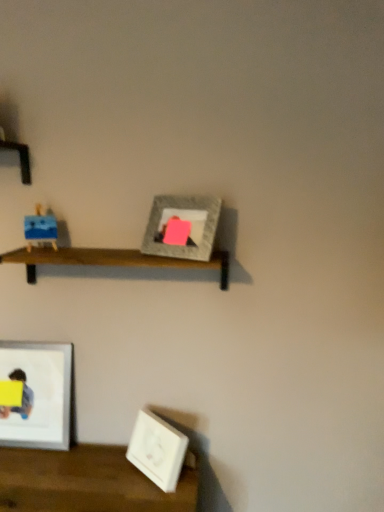
The height and width of the screenshot is (512, 384). What do you see at coordinates (22, 397) in the screenshot? I see `yellow matte paper at lower left` at bounding box center [22, 397].

This screenshot has width=384, height=512. I want to click on yellow matte paper at lower left, so click(x=22, y=397).

Could you tell me if white glossy picture frame at lower left, which is the second picture frame from top to bottom, is facing matte blue toy at left?

No.

How far apart are white glossy picture frame at lower left, the first picture frame when ordered from left to right, and matte blue toy at left?

white glossy picture frame at lower left, the first picture frame when ordered from left to right, is 19.35 inches away from matte blue toy at left.

Considering the positions of point (39, 394) and point (35, 226), is point (39, 394) closer or farther from the camera than point (35, 226)?

Point (39, 394) is farther from the camera than point (35, 226).

Can you confirm if wooden shelf at center is taller than matte blue toy at left?

In fact, wooden shelf at center may be shorter than matte blue toy at left.

Does wooden shelf at center have a lesser width compared to matte blue toy at left?

In fact, wooden shelf at center might be wider than matte blue toy at left.

Is wooden shelf at center far from matte blue toy at left?

Actually, wooden shelf at center and matte blue toy at left are a little close together.

Which point is more distant from viewer, (x=31, y=246) or (x=61, y=431)?

The point (x=61, y=431) is behind.

Consider the image. Is matte blue toy at left completely or partially outside of white glossy picture frame at lower left, positioned as the third picture frame in right-to-left order?

Yes, matte blue toy at left is not within white glossy picture frame at lower left, positioned as the third picture frame in right-to-left order.

From a real-world perspective, who is located higher, matte blue toy at left or white glossy picture frame at lower left, positioned as the third picture frame in right-to-left order?

matte blue toy at left, from a real-world perspective.

Is matte blue toy at left positioned with its back to white glossy picture frame at lower left, arranged as the second picture frame when ordered from the bottom?

matte blue toy at left is not turned away from white glossy picture frame at lower left, arranged as the second picture frame when ordered from the bottom.

Between matte gray picture frame at center, which is counted as the third picture frame, starting from the left, and matte blue toy at left, which one has more height?

Standing taller between the two is matte gray picture frame at center, which is counted as the third picture frame, starting from the left.

Which is behind, matte gray picture frame at center, which is counted as the 1th picture frame, starting from the right, or matte blue toy at left?

Positioned behind is matte blue toy at left.

Find the location of a particular element. This screenshot has height=512, width=384. the 2nd picture frame in front of the matte blue toy at left is located at coordinates (182, 220).

Is the surface of wooden shelf at center in direct contact with matte gray picture frame at center, the first picture frame in the top-to-bottom sequence?

wooden shelf at center is not next to matte gray picture frame at center, the first picture frame in the top-to-bottom sequence, and they're not touching.

Who is taller, wooden shelf at center or matte gray picture frame at center, the first picture frame in the top-to-bottom sequence?

matte gray picture frame at center, the first picture frame in the top-to-bottom sequence, is taller.

Does wooden shelf at center appear on the right side of matte gray picture frame at center, the first picture frame in the top-to-bottom sequence?

No.

Does white glossy picture frame at lower left, arranged as the second picture frame when ordered from the bottom, have a lesser width compared to matte gray picture frame at center, which is counted as the third picture frame, starting from the left?

Yes.

Consider the image. Which object is positioned more to the left, white glossy picture frame at lower left, arranged as the second picture frame when ordered from the bottom, or matte gray picture frame at center, which is counted as the third picture frame, starting from the left?

Answer: From the viewer's perspective, white glossy picture frame at lower left, arranged as the second picture frame when ordered from the bottom, appears more on the left side.

Is point (53, 397) positioned after point (174, 207)?

Yes, point (53, 397) is farther from viewer.

Image resolution: width=384 pixels, height=512 pixels. In order to click on person below the matte blue toy at left (from a real-world perspective) in this screenshot , I will do `click(22, 397)`.

Based on the photo, considering the relative sizes of matte blue toy at left and yellow matte paper at lower left in the image provided, is matte blue toy at left wider than yellow matte paper at lower left?

Indeed, matte blue toy at left has a greater width compared to yellow matte paper at lower left.

Locate an element on the screen. The height and width of the screenshot is (512, 384). the 1st picture frame positioned below the matte blue toy at left (from the image's perspective) is located at coordinates (38, 395).

Locate an element on the screen. toy on the left of the wooden shelf at center is located at coordinates (40, 228).

Which object lies further to the anchor point wooden shelf at center, white glossy picture frame at lower left, positioned as the third picture frame in right-to-left order, or matte blue toy at left?

white glossy picture frame at lower left, positioned as the third picture frame in right-to-left order.

Based on their spatial positions, is white glossy picture frame at lower left, positioned as the third picture frame in right-to-left order, or white matte picture frame at lower right, positioned as the 3th picture frame in top-to-bottom order, further from wooden shelf at center?

white matte picture frame at lower right, positioned as the 3th picture frame in top-to-bottom order, is further to wooden shelf at center.

In the scene shown: When comparing their distances from yellow matte paper at lower left, does white glossy picture frame at lower left, which is the second picture frame from top to bottom, or matte gray picture frame at center, the first picture frame in the top-to-bottom sequence, seem further?

matte gray picture frame at center, the first picture frame in the top-to-bottom sequence, is further to yellow matte paper at lower left.

Looking at the image, which one is located further to matte gray picture frame at center, which is counted as the third picture frame, starting from the left, wooden shelf at center or white glossy picture frame at lower left, the first picture frame when ordered from left to right?

Based on the image, white glossy picture frame at lower left, the first picture frame when ordered from left to right, appears to be further to matte gray picture frame at center, which is counted as the third picture frame, starting from the left.

Estimate the real-world distances between objects in this image. Which object is closer to matte blue toy at left, yellow matte paper at lower left or wooden shelf at center?

wooden shelf at center lies closer to matte blue toy at left than the other object.

Consider the image. Based on their spatial positions, is yellow matte paper at lower left or white matte picture frame at lower right, which is counted as the second picture frame, starting from the left, further from wooden shelf at center?

yellow matte paper at lower left.

Which object lies further to the anchor point matte blue toy at left, white matte picture frame at lower right, which is counted as the second picture frame, starting from the left, or matte gray picture frame at center, which is counted as the 1th picture frame, starting from the right?

white matte picture frame at lower right, which is counted as the second picture frame, starting from the left, is positioned further to the anchor matte blue toy at left.

From the image, which object appears to be nearer to yellow matte paper at lower left, matte blue toy at left or matte gray picture frame at center, which is counted as the third picture frame, starting from the left?

matte blue toy at left.

Find the location of a particular element. This screenshot has width=384, height=512. shelf between yellow matte paper at lower left and matte gray picture frame at center, which is counted as the 1th picture frame, starting from the right, from left to right is located at coordinates (110, 260).

Find the location of a particular element. The image size is (384, 512). shelf between matte gray picture frame at center, which is counted as the third picture frame, starting from the left, and white glossy picture frame at lower left, arranged as the second picture frame when ordered from the bottom, in the up-down direction is located at coordinates (110, 260).

Find the location of `person between matte blue toy at left and white matte picture frame at lower right, which is counted as the second picture frame, starting from the left, from top to bottom`. person between matte blue toy at left and white matte picture frame at lower right, which is counted as the second picture frame, starting from the left, from top to bottom is located at coordinates pyautogui.click(x=22, y=397).

Locate an element on the screen. shelf between matte blue toy at left and white glossy picture frame at lower left, the first picture frame when ordered from left to right, in the up-down direction is located at coordinates (110, 260).